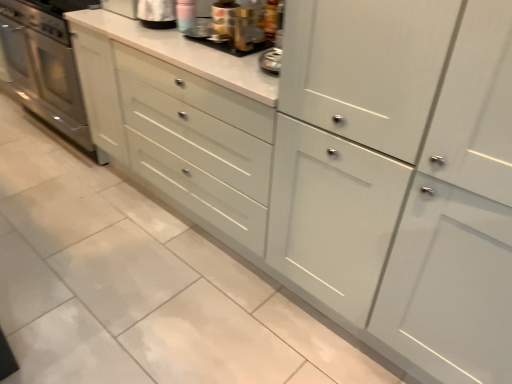
Question: Would you say stainless steel oven at left is part of metallic silver toaster at upper center, the 2th appliance viewed from the right,'s contents?

Choices:
 (A) no
 (B) yes

Answer: (A)

Question: From the image's perspective, is metallic silver toaster at upper center, which appears as the 2th appliance when viewed from the left, on stainless steel oven at left?

Choices:
 (A) yes
 (B) no

Answer: (B)

Question: From a real-world perspective, does metallic silver toaster at upper center, which appears as the 2th appliance when viewed from the left, sit lower than stainless steel oven at left?

Choices:
 (A) yes
 (B) no

Answer: (B)

Question: From a real-world perspective, is metallic silver toaster at upper center, the 2th appliance viewed from the right, on stainless steel oven at left?

Choices:
 (A) no
 (B) yes

Answer: (B)

Question: From the image's perspective, does metallic silver toaster at upper center, the 2th appliance viewed from the right, appear lower than stainless steel oven at left?

Choices:
 (A) no
 (B) yes

Answer: (B)

Question: Considering the relative positions of metallic silver toaster at upper center, which appears as the 2th appliance when viewed from the left, and metallic silver toaster at upper center, positioned as the 1th appliance in left-to-right order, in the image provided, is metallic silver toaster at upper center, which appears as the 2th appliance when viewed from the left, to the left or to the right of metallic silver toaster at upper center, positioned as the 1th appliance in left-to-right order,?

Choices:
 (A) right
 (B) left

Answer: (A)

Question: Considering the positions of metallic silver toaster at upper center, the 2th appliance viewed from the right, and metallic silver toaster at upper center, which is the third appliance from right to left, in the image, is metallic silver toaster at upper center, the 2th appliance viewed from the right, wider or thinner than metallic silver toaster at upper center, which is the third appliance from right to left,?

Choices:
 (A) thin
 (B) wide

Answer: (B)

Question: Does point (244, 52) appear closer or farther from the camera than point (170, 24)?

Choices:
 (A) closer
 (B) farther

Answer: (A)

Question: Considering the positions of metallic silver toaster at upper center, which appears as the 2th appliance when viewed from the left, and metallic silver toaster at upper center, which is the third appliance from right to left, in the image, is metallic silver toaster at upper center, which appears as the 2th appliance when viewed from the left, bigger or smaller than metallic silver toaster at upper center, which is the third appliance from right to left,?

Choices:
 (A) big
 (B) small

Answer: (B)

Question: From a real-world perspective, is metallic silver toaster at upper center, the 2th appliance viewed from the right, positioned above or below metallic gold coffee pot at upper center, the 3th appliance positioned from the left?

Choices:
 (A) below
 (B) above

Answer: (A)

Question: Visually, is metallic silver toaster at upper center, which appears as the 2th appliance when viewed from the left, positioned to the left or to the right of metallic gold coffee pot at upper center, the 1th appliance when ordered from right to left?

Choices:
 (A) right
 (B) left

Answer: (B)

Question: Is metallic silver toaster at upper center, which appears as the 2th appliance when viewed from the left, in front of or behind metallic gold coffee pot at upper center, the 1th appliance when ordered from right to left, in the image?

Choices:
 (A) behind
 (B) front

Answer: (A)

Question: Considering the positions of metallic silver toaster at upper center, the 2th appliance viewed from the right, and metallic gold coffee pot at upper center, the 3th appliance positioned from the left, in the image, is metallic silver toaster at upper center, the 2th appliance viewed from the right, wider or thinner than metallic gold coffee pot at upper center, the 3th appliance positioned from the left,?

Choices:
 (A) thin
 (B) wide

Answer: (B)

Question: Is metallic silver toaster at upper center, positioned as the 1th appliance in left-to-right order, situated inside metallic gold coffee pot at upper center, the 3th appliance positioned from the left, or outside?

Choices:
 (A) outside
 (B) inside

Answer: (A)

Question: Is metallic silver toaster at upper center, which is the third appliance from right to left, wider or thinner than metallic gold coffee pot at upper center, the 1th appliance when ordered from right to left?

Choices:
 (A) thin
 (B) wide

Answer: (B)